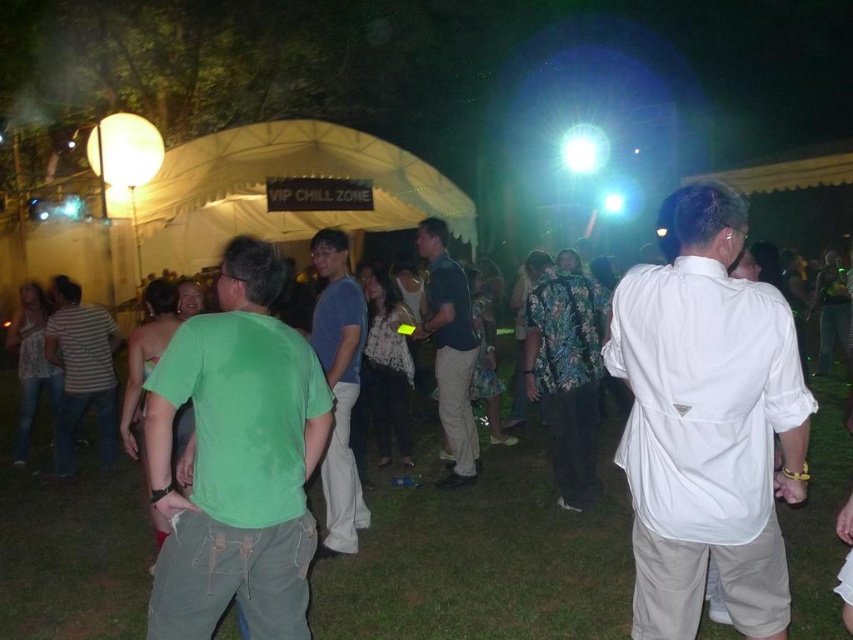
Question: Among these points, which one is farthest from the camera?

Choices:
 (A) (543, 413)
 (B) (746, 432)
 (C) (67, 422)

Answer: (C)

Question: Considering the real-world distances, which object is closest to the floral-patterned shirt at center?

Choices:
 (A) dark blue shirt at center
 (B) green cotton t-shirt at center
 (C) striped cotton shirt at center
 (D) white matte shirt at right

Answer: (A)

Question: Is dark blue shirt at center wider than striped cotton shirt at center?

Choices:
 (A) yes
 (B) no

Answer: (B)

Question: Does green cotton t-shirt at center have a larger size compared to blue cotton shirt at center?

Choices:
 (A) yes
 (B) no

Answer: (B)

Question: Considering the real-world distances, which object is farthest from the floral-patterned shirt at center?

Choices:
 (A) striped cotton shirt at center
 (B) green cotton t-shirt at center

Answer: (A)

Question: Does white matte shirt at right appear on the right side of dark blue shirt at center?

Choices:
 (A) yes
 (B) no

Answer: (A)